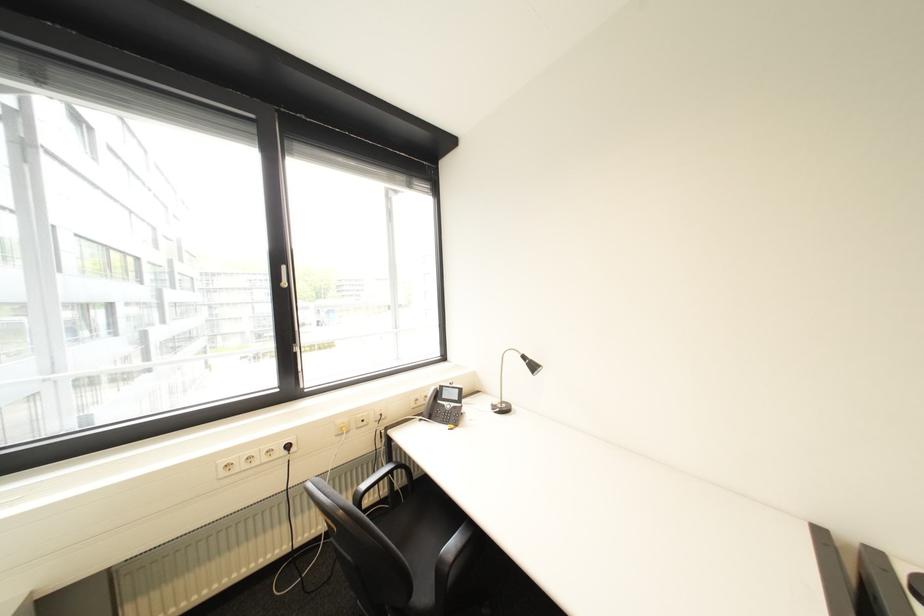
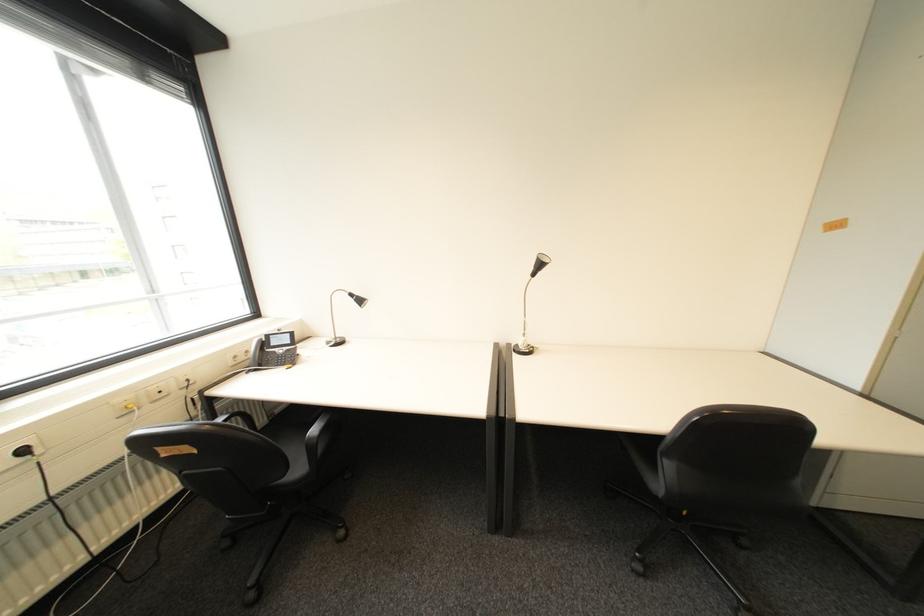
Find the pixel in the second image that matches point (535, 363) in the first image.

(362, 301)